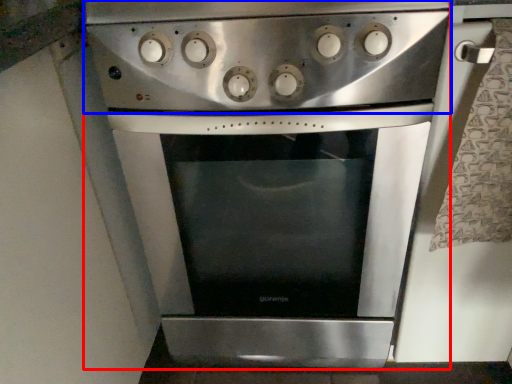
Question: Which of the following is the closest to the observer, oven (highlighted by a red box) or gas stove (highlighted by a blue box)?

Choices:
 (A) oven
 (B) gas stove

Answer: (B)